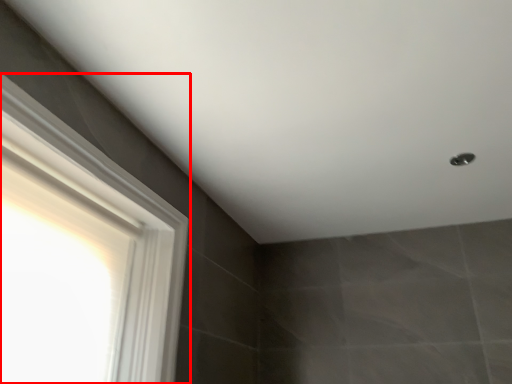
Question: From the image's perspective, considering the relative positions of window (annotated by the red box) and shower in the image provided, where is window (annotated by the red box) located with respect to the staircase?

Choices:
 (A) above
 (B) below

Answer: (B)